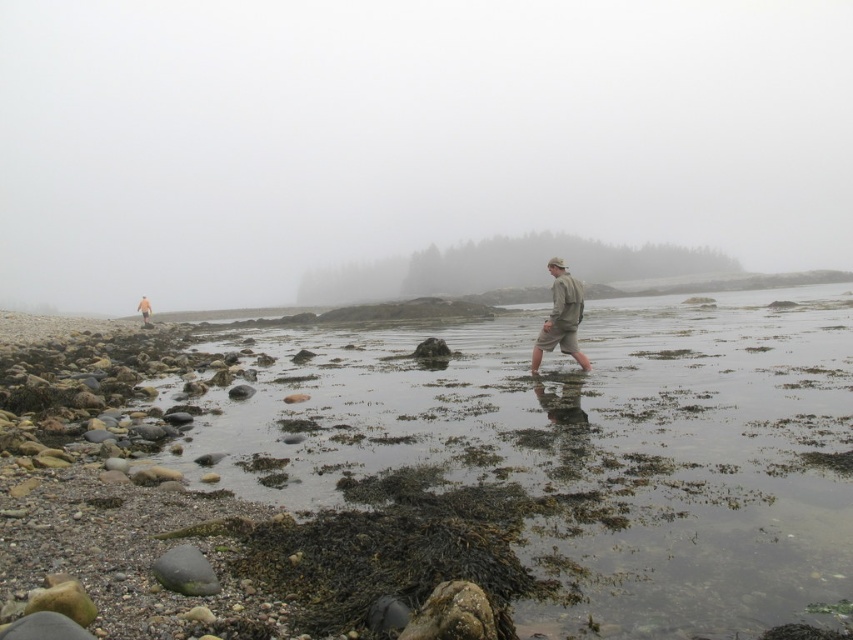
Question: Which object appears closest to the camera in this image?

Choices:
 (A) camouflage fabric jacket at lower left
 (B) foggy at center
 (C) khaki fabric shorts at center

Answer: (C)

Question: Considering the relative positions of foggy at center and camouflage fabric jacket at lower left in the image provided, where is foggy at center located with respect to camouflage fabric jacket at lower left?

Choices:
 (A) right
 (B) left

Answer: (A)

Question: Which point appears closest to the camera in this image?

Choices:
 (A) (143, 301)
 (B) (570, 292)
 (C) (685, 269)

Answer: (B)

Question: Is khaki fabric shorts at center to the right of camouflage fabric jacket at lower left from the viewer's perspective?

Choices:
 (A) no
 (B) yes

Answer: (B)

Question: Which object is positioned closest to the camouflage fabric jacket at lower left?

Choices:
 (A) foggy at center
 (B) khaki fabric shorts at center

Answer: (B)

Question: Can you confirm if khaki fabric shorts at center is positioned to the left of camouflage fabric jacket at lower left?

Choices:
 (A) yes
 (B) no

Answer: (B)